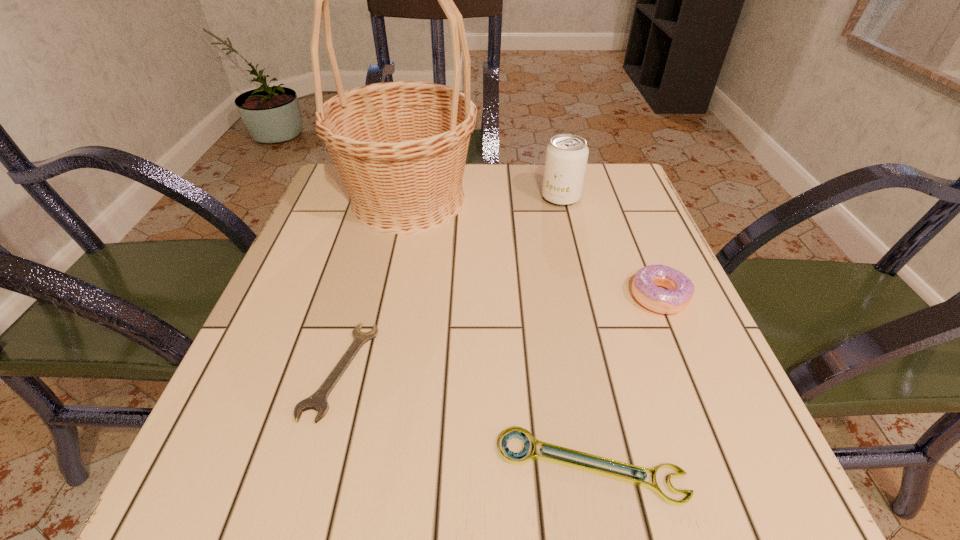
Where is `the tallest object`? This screenshot has width=960, height=540. the tallest object is located at coordinates (400, 147).

Find the location of a particular element. The image size is (960, 540). soda can is located at coordinates (566, 157).

Image resolution: width=960 pixels, height=540 pixels. What are the coordinates of `the rightmost object` in the screenshot? It's located at (681, 289).

Find the location of a particular element. doughnut is located at coordinates tap(681, 289).

At what (x,y) coordinates should I click in order to perform the action: click on the nearer wrench. Please return your answer as a coordinate pair (x, y). The width and height of the screenshot is (960, 540). Looking at the image, I should click on (513, 432).

I want to click on the nearest object, so click(513, 432).

Locate an element on the screen. The image size is (960, 540). the fourth farthest object is located at coordinates (318, 401).

Identify the location of the farther wrench. (318, 401).

At what (x,y) coordinates should I click in order to perform the action: click on vacant space located on the right of the basket. Please return your answer as a coordinate pair (x, y). The height and width of the screenshot is (540, 960). Looking at the image, I should click on pyautogui.click(x=618, y=200).

Image resolution: width=960 pixels, height=540 pixels. In order to click on vacant position located on the left of the soda can in this screenshot , I will do tap(500, 198).